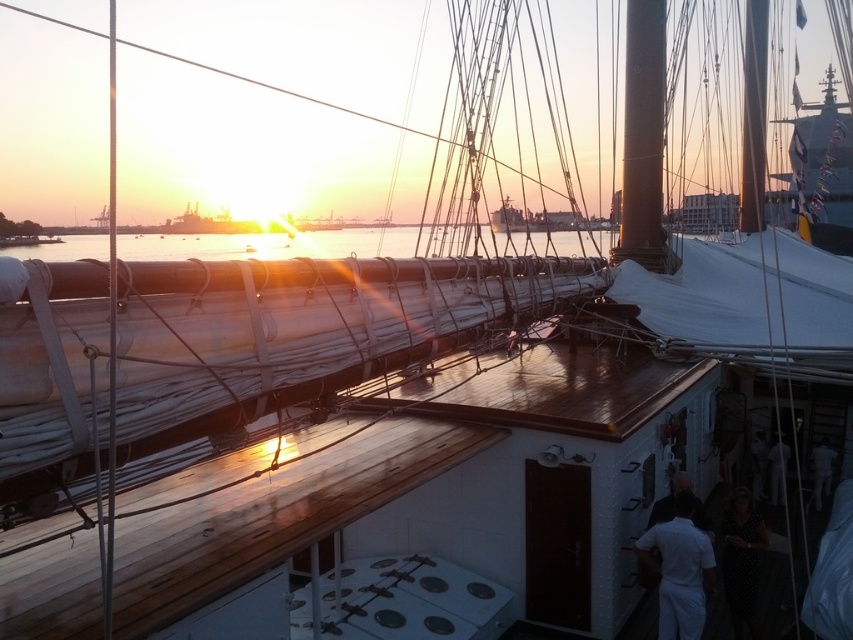
Between shiny metallic water at center and metallic polished mast at upper center, which one is positioned lower?

shiny metallic water at center

Is point (503, 250) farther from viewer compared to point (753, 51)?

No, it is in front of (753, 51).

Is point (579, 252) behind point (746, 148)?

No, it is not.

Identify the location of shiny metallic water at center. The image size is (853, 640). (270, 244).

Who is positioned more to the left, shiny metallic water at center or smooth brown wood mast at upper center?

shiny metallic water at center is more to the left.

Is shiny metallic water at center further to the viewer compared to smooth brown wood mast at upper center?

No, shiny metallic water at center is closer to the viewer.

Measure the distance between point (x=482, y=248) and camera.

They are 10.84 meters apart.

Find the location of `shiny metallic water at center`. shiny metallic water at center is located at coordinates (270, 244).

What do you see at coordinates (643, 138) in the screenshot? Image resolution: width=853 pixels, height=640 pixels. I see `smooth brown wood mast at upper center` at bounding box center [643, 138].

Who is more distant from viewer, [659,218] or [747,61]?

The point [747,61] is more distant.

Does point (630, 224) come in front of point (749, 163)?

Yes.

Find the location of a particular element. This screenshot has height=640, width=853. smooth brown wood mast at upper center is located at coordinates (643, 138).